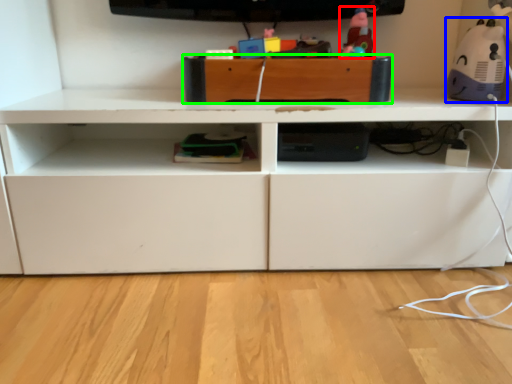
Question: Estimate the real-world distances between objects in this image. Which object is farther from toy (highlighted by a red box), toy (highlighted by a blue box) or drawer (highlighted by a green box)?

Choices:
 (A) toy
 (B) drawer

Answer: (A)